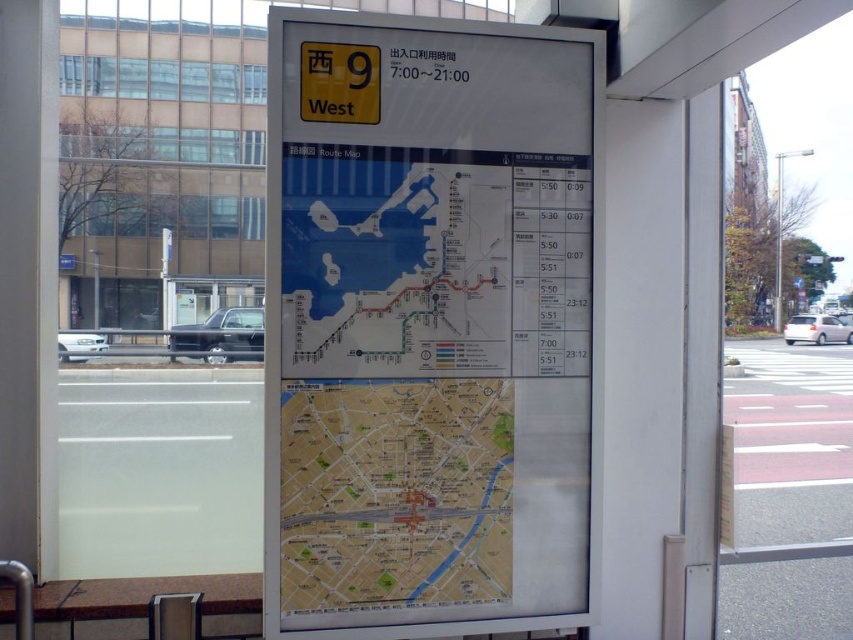
Question: Does white paper map at center have a greater width compared to yellow paper map at center?

Choices:
 (A) yes
 (B) no

Answer: (A)

Question: Does white paper map at center appear over yellow paper map at center?

Choices:
 (A) no
 (B) yes

Answer: (B)

Question: Does white paper map at center appear on the left side of yellow paper map at center?

Choices:
 (A) yes
 (B) no

Answer: (B)

Question: Which point appears closest to the camera in this image?

Choices:
 (A) (321, 280)
 (B) (412, 573)

Answer: (A)